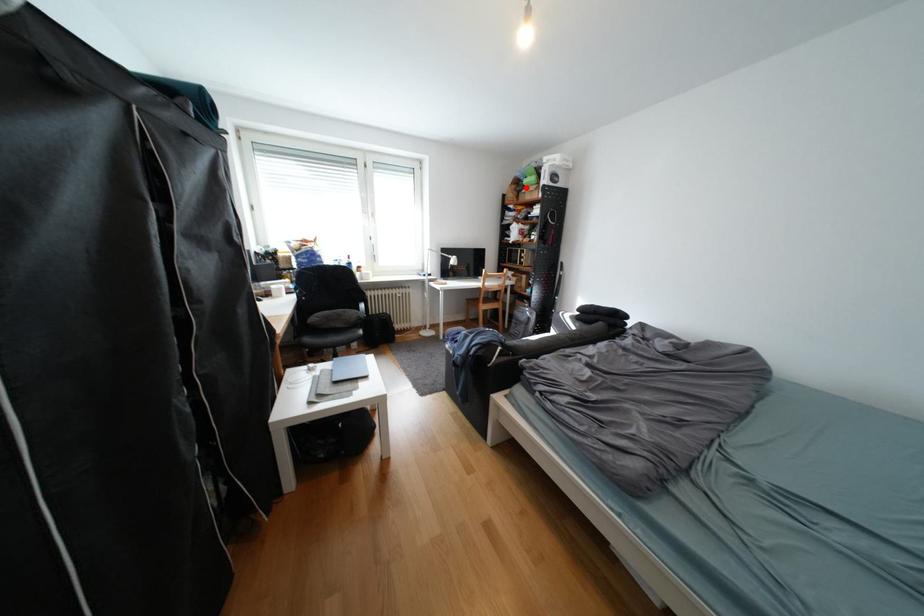
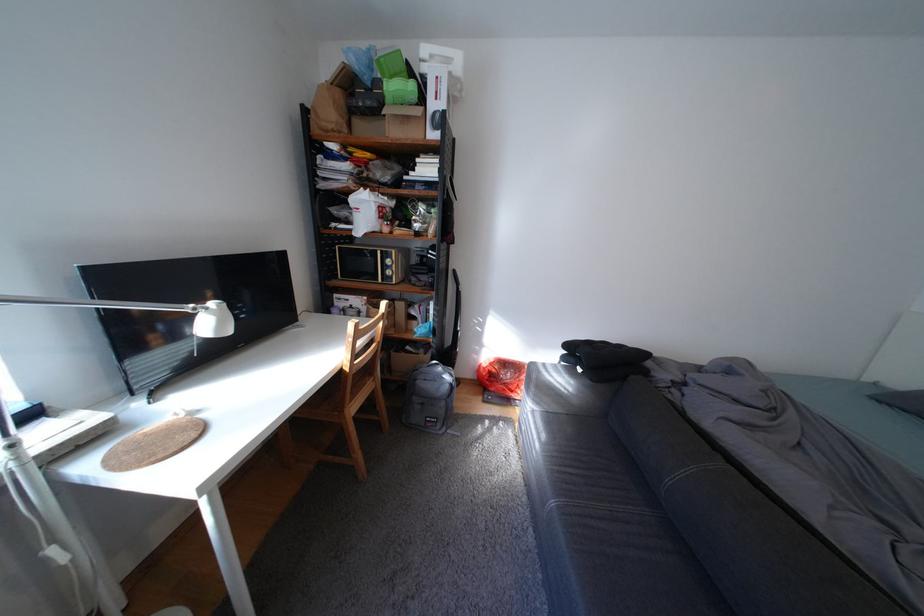
Question: I am providing you with two images of the same scene from different viewpoints. Given a red point in image1, look at the same physical point in image2. Is it:

Choices:
 (A) Closer to the viewpoint
 (B) Farther from the viewpoint

Answer: (B)